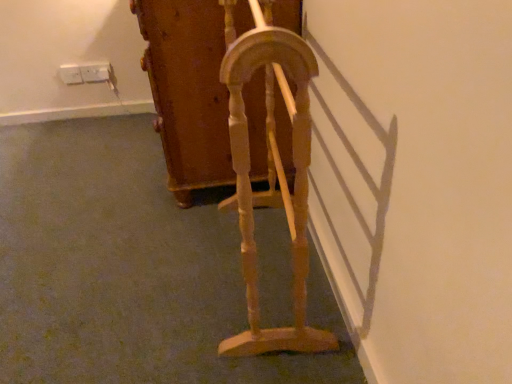
Question: From a real-world perspective, is white plastic electric outlet at upper left, arranged as the 2th electric outlet when viewed from the right, positioned above or below light wood/woodenobject at center, which is counted as the 2th furniture, starting from the back?

Choices:
 (A) above
 (B) below

Answer: (B)

Question: Considering the positions of white plastic electric outlet at upper left, placed as the 1th electric outlet when sorted from left to right, and light wood/woodenobject at center, which is counted as the 2th furniture, starting from the back, in the image, is white plastic electric outlet at upper left, placed as the 1th electric outlet when sorted from left to right, taller or shorter than light wood/woodenobject at center, which is counted as the 2th furniture, starting from the back,?

Choices:
 (A) tall
 (B) short

Answer: (B)

Question: Which of these objects is positioned farthest from the light wood/woodenobject at center, which is counted as the 2th furniture, starting from the back?

Choices:
 (A) wooden cabinet at center, positioned as the first furniture in back-to-front order
 (B) white plastic electric outlet at upper left, positioned as the 2th electric outlet in left-to-right order
 (C) white plastic electric outlet at upper left, placed as the 1th electric outlet when sorted from left to right

Answer: (C)

Question: Considering the real-world distances, which object is closest to the wooden cabinet at center, the 2th furniture viewed from the front?

Choices:
 (A) light wood/woodenobject at center, which is counted as the 2th furniture, starting from the back
 (B) white plastic electric outlet at upper left, arranged as the 2th electric outlet when viewed from the right
 (C) white plastic electric outlet at upper left, positioned as the 2th electric outlet in left-to-right order

Answer: (A)